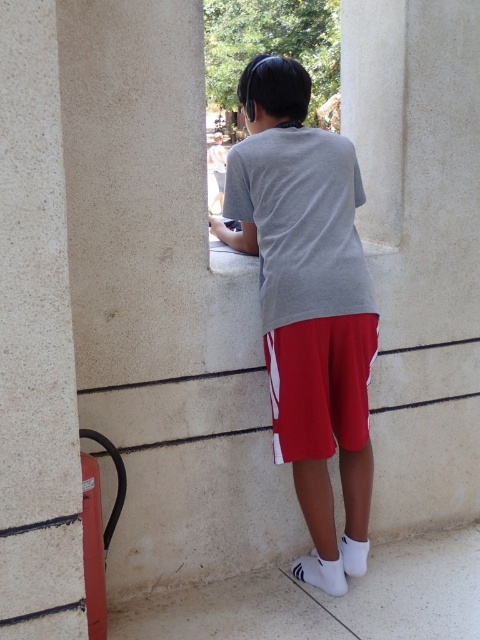
From the picture: You are standing at the point with coordinates point (336,435) and want to walk to the point with coordinates point (46,627). According to the image, is the destination point closer to you or further away?

Point (46,627) is in front of point (336,435), so the destination point is closer to you.

You are a photographer trying to capture a candid shot of the person in the scene. Since you want to focus on the person, you need to avoid having the white textured pillar at left overlapping with the red cotton shorts at center in your photo. Based on their positions, is this possible?

The white textured pillar at left is in front of the red cotton shorts at center, so the pillar will block the view of the shorts. To avoid overlap, you need to adjust your angle so the pillar is not between you and the shorts.